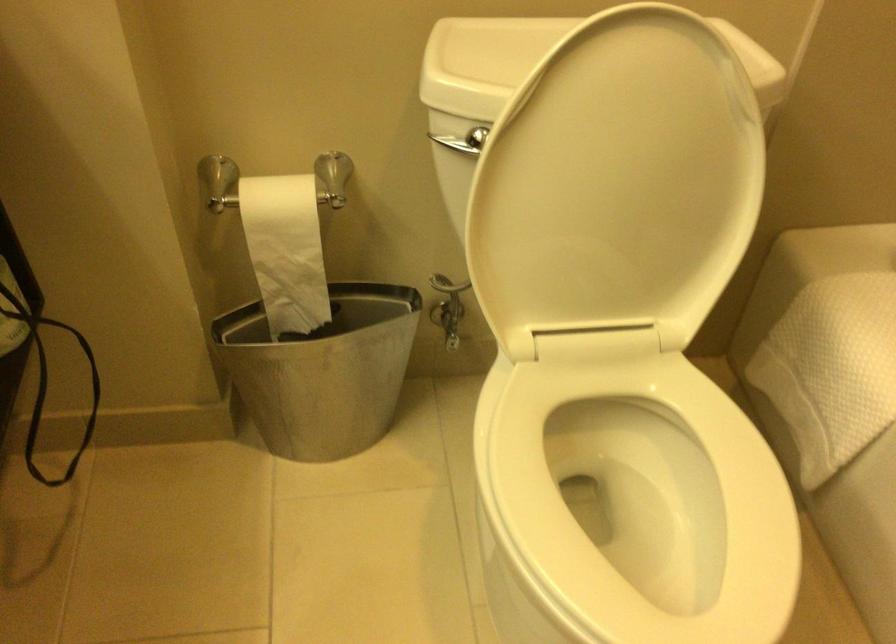
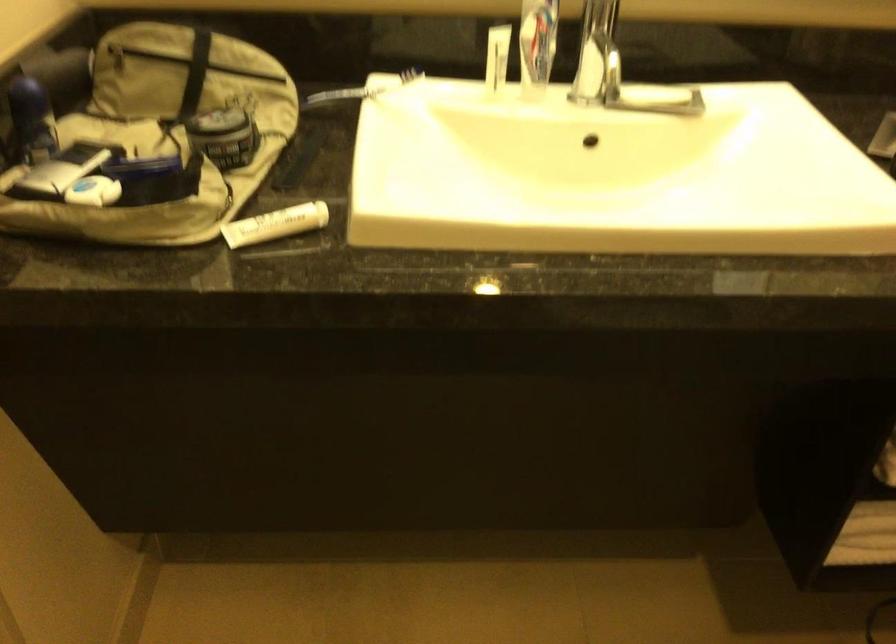
The first image is from the beginning of the video and the second image is from the end. How did the camera likely rotate when shooting the video?

The camera rotated toward left-down.